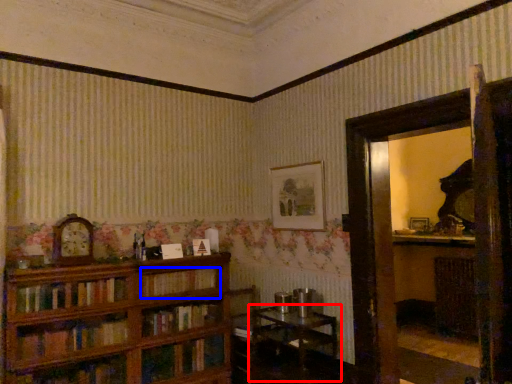
Question: Among these objects, which one is nearest to the camera, table (highlighted by a red box) or book (highlighted by a blue box)?

Choices:
 (A) table
 (B) book

Answer: (A)